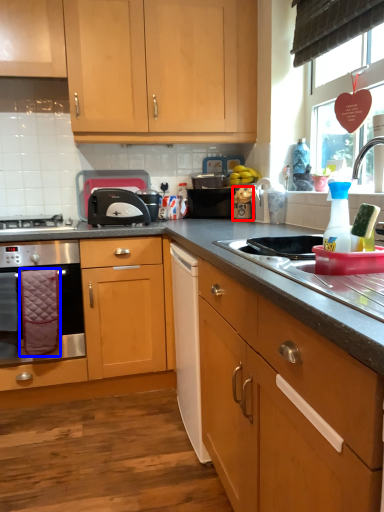
Question: Which point is closer to the camera, appliance (highlighted by a red box) or material (highlighted by a blue box)?

Choices:
 (A) appliance
 (B) material

Answer: (B)